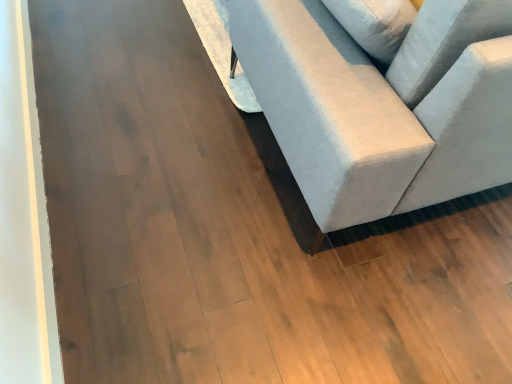
Question: Should I look upward or downward to see light gray fabric couch at center?

Choices:
 (A) up
 (B) down

Answer: (A)